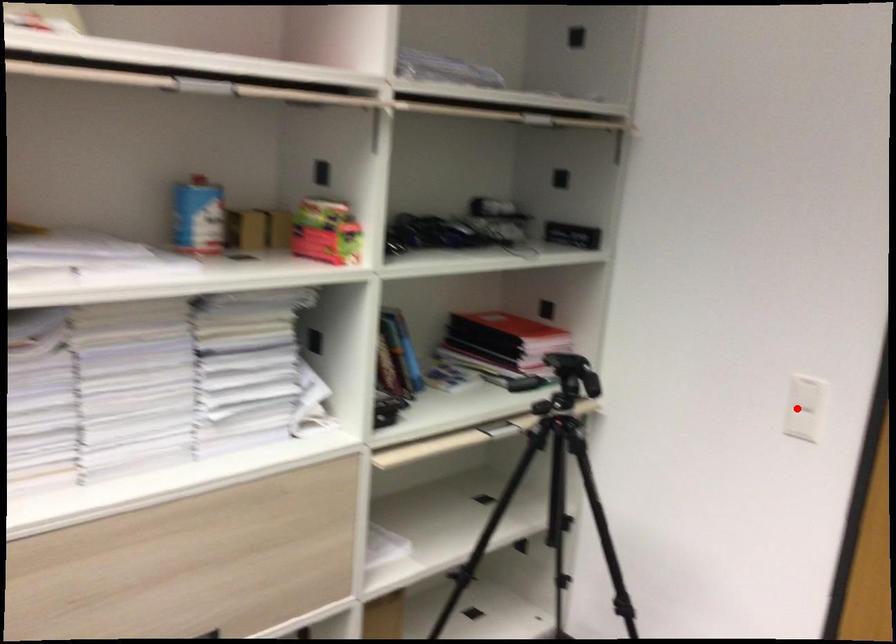
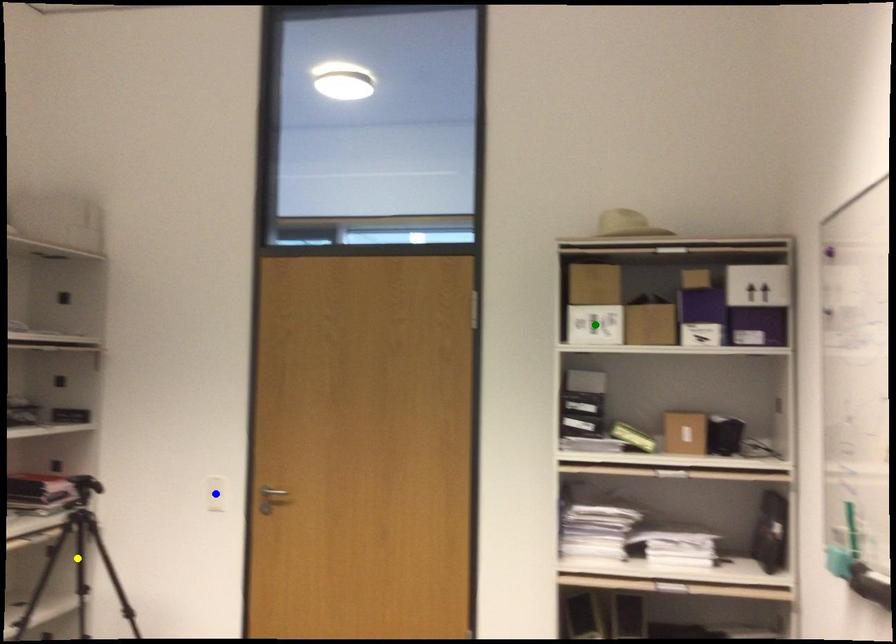
Question: I am providing you with two images of the same scene from different viewpoints. A red point is marked on the first image. You are given multiple points on the second image. In image 2, which mark is for the same physical point as the one in image 1?

Choices:
 (A) yellow point
 (B) green point
 (C) blue point

Answer: (C)